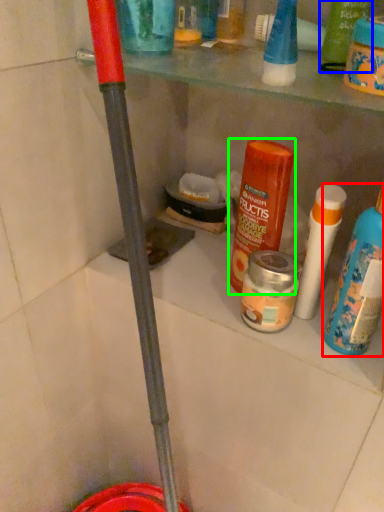
Question: Based on their relative distances, which object is nearer to bottle (highlighted by a red box)? Choose from product (highlighted by a blue box) and product (highlighted by a green box).

Choices:
 (A) product
 (B) product

Answer: (B)